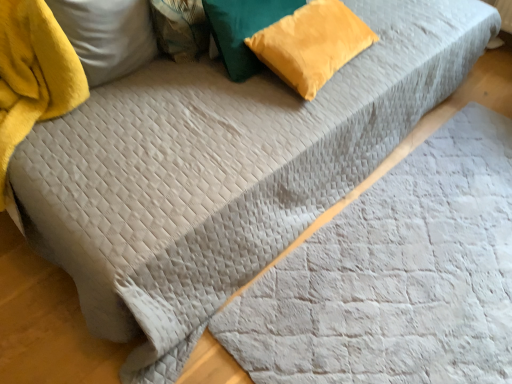
Question: From the image's perspective, is yellow velvet pillow at upper left, acting as the 1th pillow starting from the left, located above or below gray quilted blanket at center?

Choices:
 (A) above
 (B) below

Answer: (A)

Question: From a real-world perspective, is yellow velvet pillow at upper left, the third pillow viewed from the right, positioned above or below gray quilted blanket at center?

Choices:
 (A) above
 (B) below

Answer: (A)

Question: Estimate the real-world distances between objects in this image. Which object is closer to the yellow velvet pillow at upper left, the third pillow viewed from the right?

Choices:
 (A) gray quilted blanket at center
 (B) velvet yellow pillow at upper right, positioned as the third pillow in left-to-right order
 (C) velvet yellow pillow at upper center, the 2th pillow viewed from the right

Answer: (C)

Question: Which of these objects is positioned farthest from the yellow velvet pillow at upper left, the third pillow viewed from the right?

Choices:
 (A) velvet yellow pillow at upper center, the 2th pillow viewed from the right
 (B) velvet yellow pillow at upper right, positioned as the third pillow in left-to-right order
 (C) gray quilted blanket at center

Answer: (C)